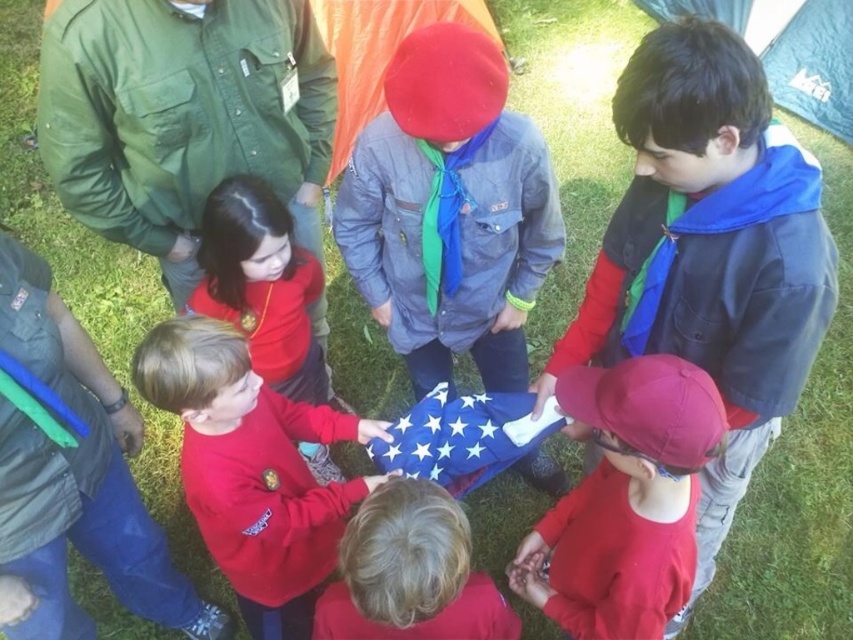
Is point (817, 44) less distant than point (543, 401)?

No, (817, 44) is behind (543, 401).

Between green fabric tent at upper right and matte blue fabric at lower center, which one is positioned higher?

green fabric tent at upper right is higher up.

Is point (733, 20) farther from camera compared to point (550, 384)?

Yes, it is behind point (550, 384).

You are a GUI agent. You are given a task and a screenshot of the screen. Output one action in this format:
    pyautogui.click(x=<x>, y=<y>)
    Task: Click on the green fabric tent at upper right
    The image size is (853, 640).
    Given the screenshot: What is the action you would take?
    pyautogui.click(x=814, y=65)

Is blue fabric flag at center bigger than green fabric tent at upper right?

Incorrect, blue fabric flag at center is not larger than green fabric tent at upper right.

Is point (413, 406) closer to viewer compared to point (664, 1)?

That is True.

Locate an element on the screen. The width and height of the screenshot is (853, 640). blue fabric flag at center is located at coordinates point(463,436).

Does red matte shirt at lower left have a larger size compared to matte blue fabric at lower center?

Yes.

Can you confirm if red matte shirt at lower left is wider than matte blue fabric at lower center?

Indeed, red matte shirt at lower left has a greater width compared to matte blue fabric at lower center.

Is point (262, 349) farther from camera compared to point (547, 392)?

Yes.

Locate an element on the screen. red matte shirt at lower left is located at coordinates (260, 284).